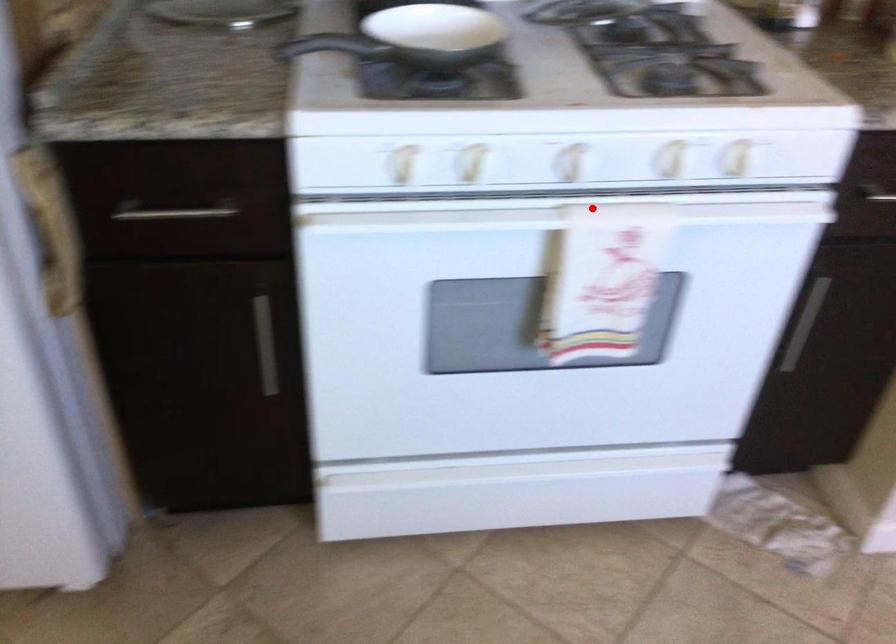
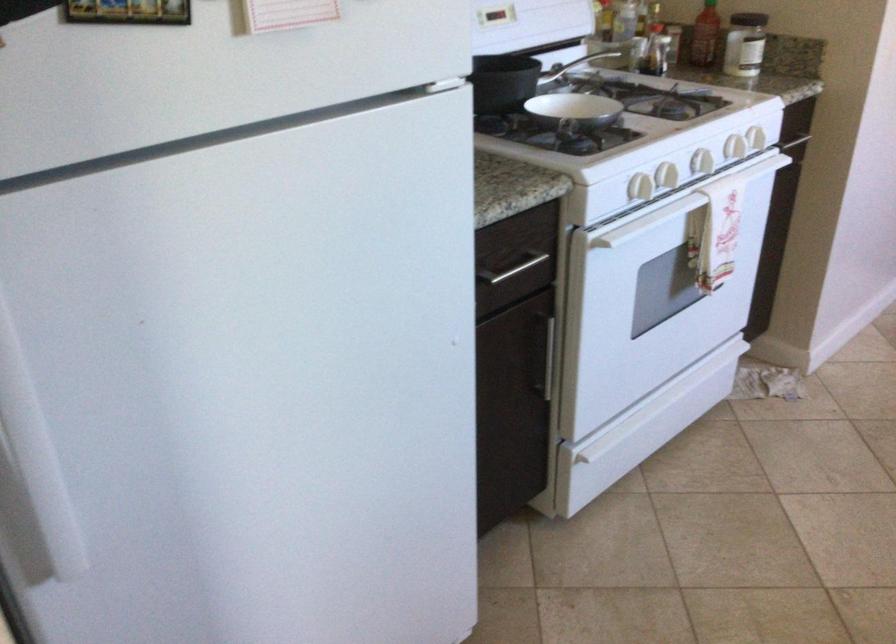
The point at the highlighted location is marked in the first image. Where is the corresponding point in the second image?

(734, 147)